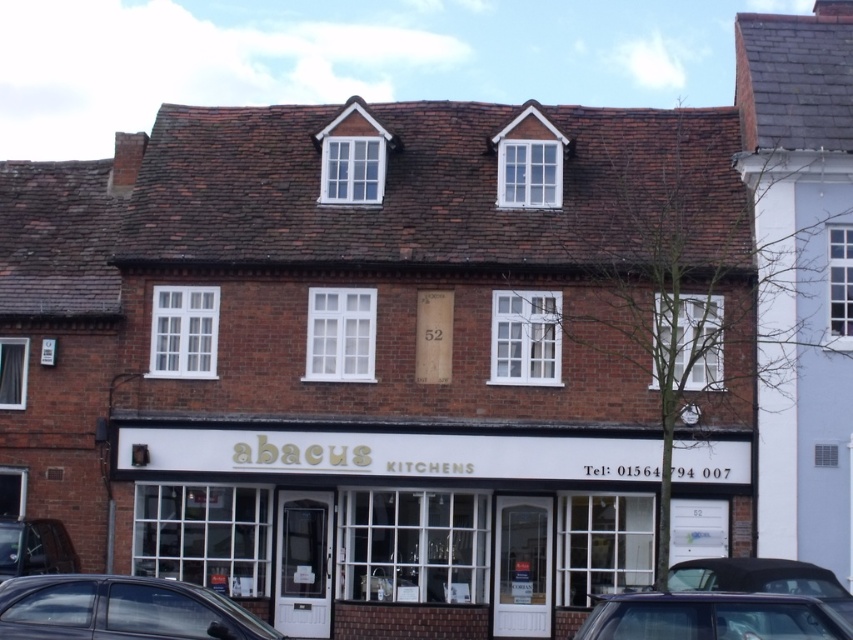
Is white wooden storefront at center below metallic gray car at lower center?

No.

Which is more to the left, white wooden storefront at center or metallic gray car at lower center?

From the viewer's perspective, white wooden storefront at center appears more on the left side.

What are the coordinates of `white wooden storefront at center` in the screenshot? It's located at (392, 454).

Where is `white wooden storefront at center`? Image resolution: width=853 pixels, height=640 pixels. white wooden storefront at center is located at coordinates (392, 454).

Who is taller, white wooden storefront at center or metallic silver car at lower left?

white wooden storefront at center

Image resolution: width=853 pixels, height=640 pixels. What do you see at coordinates (392, 454) in the screenshot? I see `white wooden storefront at center` at bounding box center [392, 454].

Find the location of a particular element. white wooden storefront at center is located at coordinates (392, 454).

Who is shorter, metallic gray car at lower center or metallic silver car at lower left?

With less height is metallic silver car at lower left.

In order to click on metallic gray car at lower center in this screenshot , I will do `click(711, 616)`.